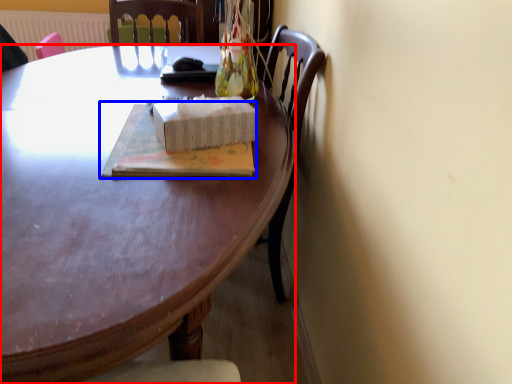
Question: Among these objects, which one is farthest to the camera, desk (highlighted by a red box) or book (highlighted by a blue box)?

Choices:
 (A) desk
 (B) book

Answer: (B)